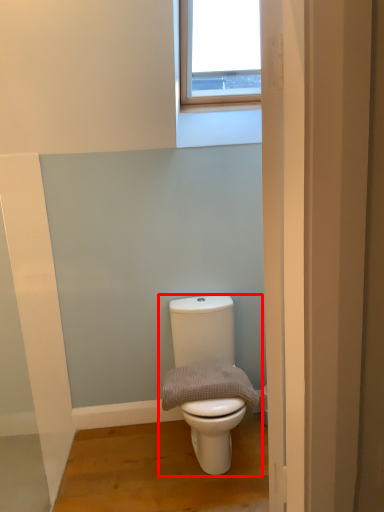
Question: Observing the image, what is the correct spatial positioning of toilet (annotated by the red box) in reference to gray?

Choices:
 (A) left
 (B) right

Answer: (B)